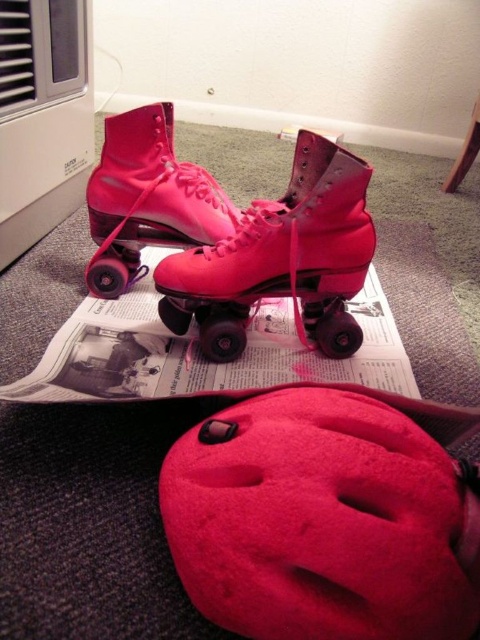
In the scene shown: Does matte pink roller skate at center have a lesser height compared to pink matte roller skate at center?

No.

Does matte pink roller skate at center appear under pink matte roller skate at center?

Correct, matte pink roller skate at center is located below pink matte roller skate at center.

Is point (195, 296) closer to camera compared to point (226, 209)?

Yes.

The height and width of the screenshot is (640, 480). What are the coordinates of `matte pink roller skate at center` in the screenshot? It's located at (282, 259).

Which of these two, matte pink roller skate at center or printed paper magazine at center, stands shorter?

With less height is printed paper magazine at center.

How much distance is there between matte pink roller skate at center and printed paper magazine at center?

matte pink roller skate at center and printed paper magazine at center are 4.17 inches apart from each other.

The width and height of the screenshot is (480, 640). Find the location of `matte pink roller skate at center`. matte pink roller skate at center is located at coordinates (282, 259).

What do you see at coordinates (197, 355) in the screenshot?
I see `printed paper magazine at center` at bounding box center [197, 355].

Is point (300, 380) farther from camera compared to point (107, 136)?

That is False.

Which is in front, point (392, 390) or point (167, 128)?

Point (392, 390) is more forward.

In order to click on printed paper magazine at center in this screenshot , I will do `click(197, 355)`.